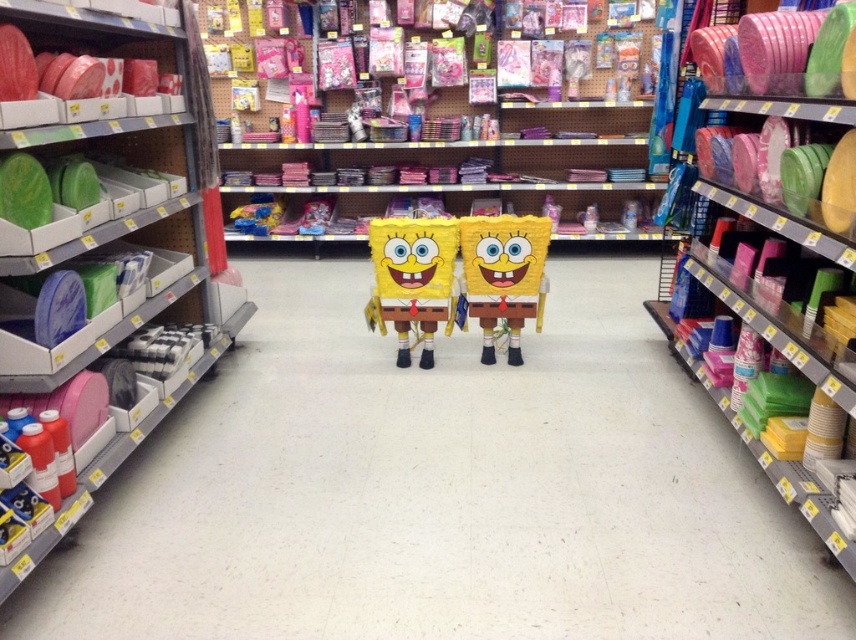
You are organizing a party and need to choose plates for your guests. You see the green matte plates at left and the matte plastic plates at right in the store aisle. Which set of plates is positioned closer to the entrance of the aisle?

The green matte plates at left are positioned closer to the entrance of the aisle because they are to the left of the matte plastic plates at right, and in typical store layouts, items on the left side of an aisle are closer to the entrance.

You are a store employee organizing items in the party supplies aisle. You need to place a new SpongeBob SquarePants pinata in the center of the aisle. The current SpongeBob pinatas are already placed at the center. To avoid overcrowding, you want to ensure there is enough space between the new pinata and the existing ones. Based on the current layout, where exactly are the green matte plates at left located in relation to the SpongeBob pinatas?

The green matte plates at left are located at point (107, 253), which is to the left side of the SpongeBob pinatas in the center.

You are a store employee organizing the party supplies aisle. You need to place a new yellow matte pinata at center on the shelf. However, there are already green matte plates at left on the same shelf. Can you fit the new pinata next to the plates without moving any existing items?

The green matte plates at left are positioned over the yellow matte pinata at center, meaning the pinata is placed below the plates. Since the plates are already occupying the space above, you cannot fit the new pinata next to them without rearranging the existing items.